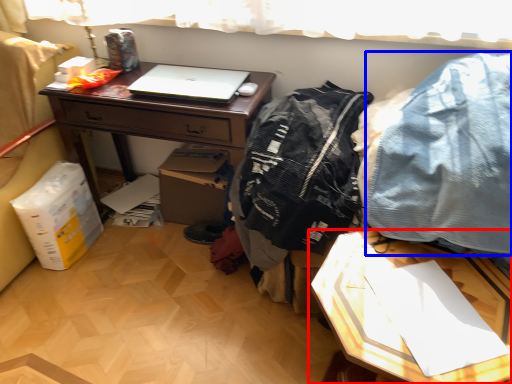
Question: Among these objects, which one is nearest to the camera, table (highlighted by a red box) or clothing (highlighted by a blue box)?

Choices:
 (A) table
 (B) clothing

Answer: (A)